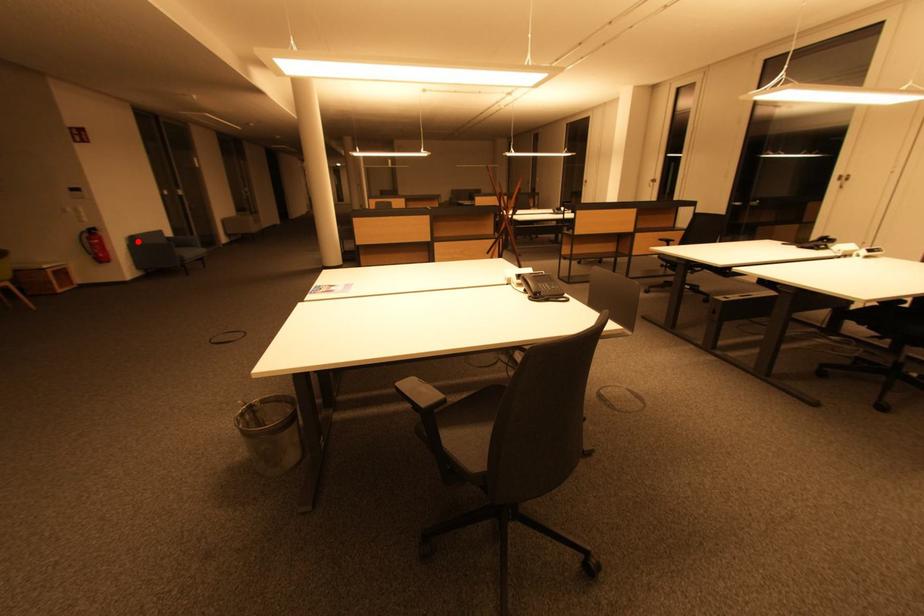
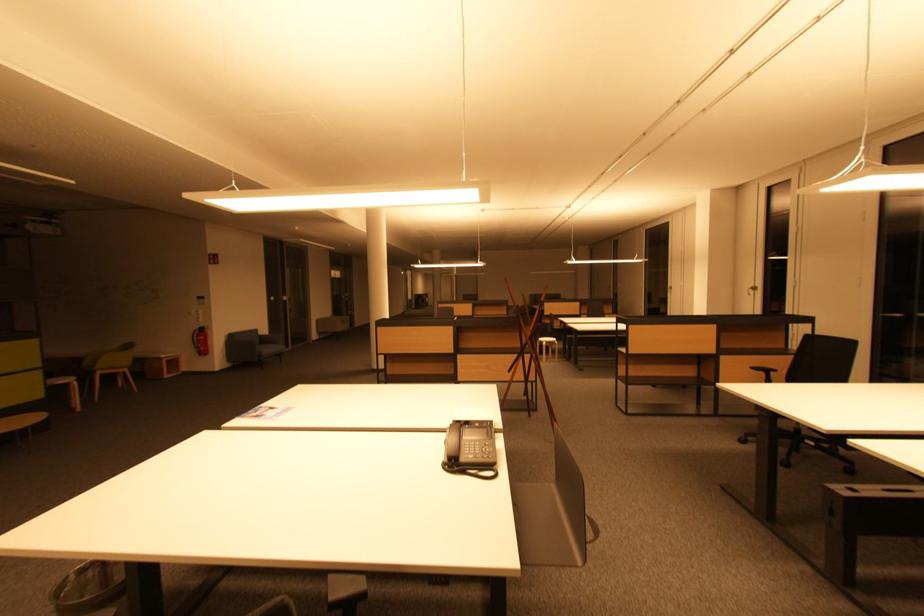
Question: I am providing you with two images of the same scene from different viewpoints. A red point is shown in image1. For the corresponding object point in image2, is it positioned nearer or farther from the camera?

Choices:
 (A) Nearer
 (B) Farther

Answer: (A)